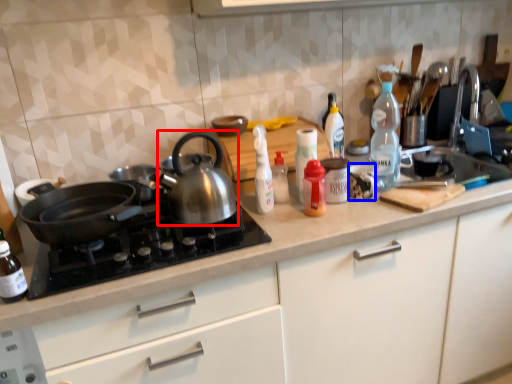
Question: Which of the following is the closest to the observer, kettle (highlighted by a red box) or tableware (highlighted by a blue box)?

Choices:
 (A) kettle
 (B) tableware

Answer: (A)